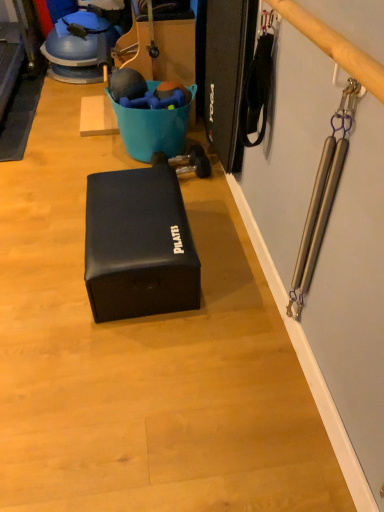
Identify the location of vacant space in front of black leather box at center. The width and height of the screenshot is (384, 512). (141, 370).